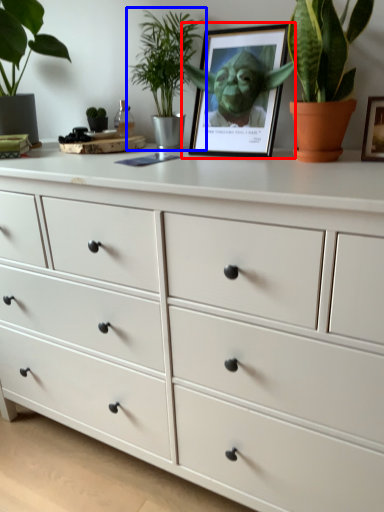
Question: Among these objects, which one is nearest to the camera, picture frame (highlighted by a red box) or houseplant (highlighted by a blue box)?

Choices:
 (A) picture frame
 (B) houseplant

Answer: (A)